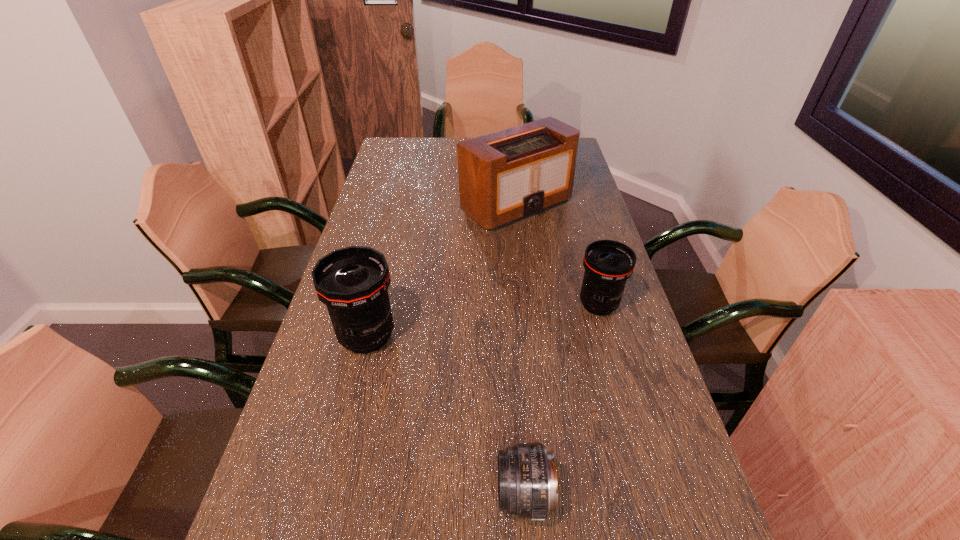
Where is `empty space that is in between the leftmost telephoto lens and the shortest object`? The width and height of the screenshot is (960, 540). empty space that is in between the leftmost telephoto lens and the shortest object is located at coordinates (445, 415).

Locate an element on the screen. The image size is (960, 540). empty space that is in between the second shortest telephoto lens and the tallest telephoto lens is located at coordinates (483, 320).

Where is `free area in between the leftmost object and the shortest telephoto lens`? The image size is (960, 540). free area in between the leftmost object and the shortest telephoto lens is located at coordinates (445, 415).

What are the coordinates of `unoccupied area between the second shortest object and the leftmost object` in the screenshot? It's located at (x=483, y=320).

Identify the location of free spot between the farthest object and the tallest telephoto lens. (442, 271).

Locate an element on the screen. The height and width of the screenshot is (540, 960). free space between the shortest object and the radio receiver is located at coordinates (520, 350).

The height and width of the screenshot is (540, 960). What are the coordinates of `vacant space that is in between the leftmost telephoto lens and the radio receiver` in the screenshot? It's located at (442, 271).

Locate an element on the screen. free spot between the farthest object and the nearest telephoto lens is located at coordinates (520, 350).

Image resolution: width=960 pixels, height=540 pixels. I want to click on vacant space that's between the second telephoto lens from right to left and the rightmost telephoto lens, so click(562, 400).

The height and width of the screenshot is (540, 960). What are the coordinates of `empty space that is in between the rightmost telephoto lens and the tallest telephoto lens` in the screenshot? It's located at (483, 320).